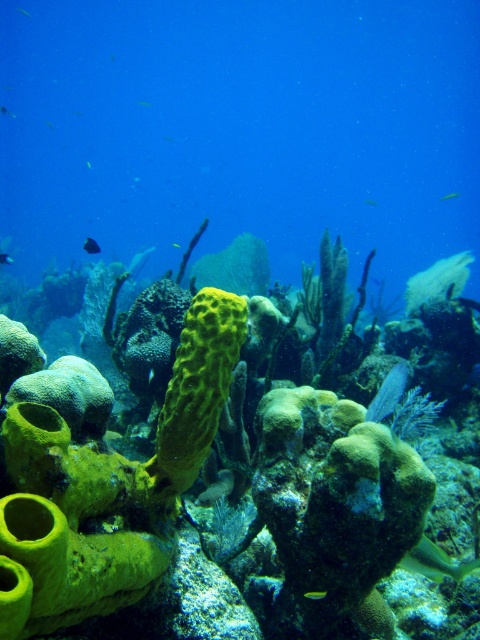
Between point (3, 259) and point (448, 195), which one is positioned behind?

The point (448, 195) is behind.

This screenshot has height=640, width=480. What are the coordinates of `shiny blue fish at upper left` in the screenshot? It's located at (4, 259).

Where is `shiny blue fish at upper left`? shiny blue fish at upper left is located at coordinates (4, 259).

Can you confirm if green matte fish at upper center is positioned to the right of translucent yellow fish at center?

Correct, you'll find green matte fish at upper center to the right of translucent yellow fish at center.

Does green matte fish at upper center come behind translucent yellow fish at center?

No, green matte fish at upper center is closer to the viewer.

Locate an element on the screen. green matte fish at upper center is located at coordinates (371, 202).

Is shiny yellow-green fish at center above translucent yellow fish at center?

No.

Can you confirm if shiny yellow-green fish at center is smaller than translucent yellow fish at center?

Indeed, shiny yellow-green fish at center has a smaller size compared to translucent yellow fish at center.

This screenshot has height=640, width=480. I want to click on shiny yellow-green fish at center, so click(x=315, y=595).

Where is `shiny yellow-green fish at center`? Image resolution: width=480 pixels, height=640 pixels. shiny yellow-green fish at center is located at coordinates (315, 595).